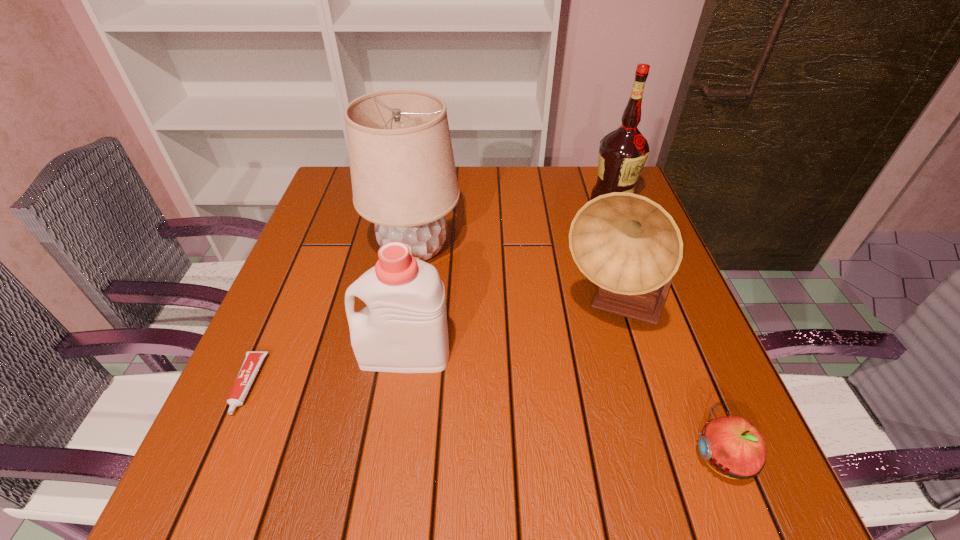
Identify the location of phonograph record that is at the right edge. (628, 245).

Locate an element on the screen. apple that is at the right edge is located at coordinates (732, 445).

Image resolution: width=960 pixels, height=540 pixels. Find the location of `object that is positioned at the far right corner`. object that is positioned at the far right corner is located at coordinates click(623, 152).

Where is `object at the near right corner`? The width and height of the screenshot is (960, 540). object at the near right corner is located at coordinates (732, 445).

Identify the location of free location at the far edge of the desktop. [564, 191].

Where is `vacant space at the near edge`? This screenshot has height=540, width=960. vacant space at the near edge is located at coordinates (334, 479).

Image resolution: width=960 pixels, height=540 pixels. In the image, there is a desktop. Find the location of `vacant region at the left edge`. vacant region at the left edge is located at coordinates (246, 415).

In order to click on vacant space at the right edge of the desktop in this screenshot , I will do `click(636, 340)`.

At what (x,y) coordinates should I click in order to perform the action: click on free space at the far left corner of the desktop. Please return your answer as a coordinate pair (x, y). Looking at the image, I should click on (351, 201).

Where is `vacant space at the near left corner`? vacant space at the near left corner is located at coordinates (220, 462).